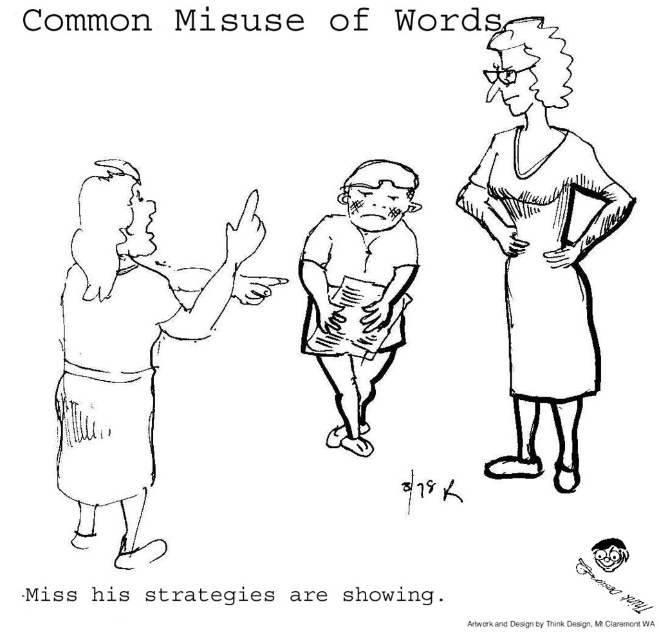
Based on the scene description, which object is bigger between the smooth skin man at left and the fat man at center?

The smooth skin man at left is bigger than the fat man at center according to the description.

In the cartoon scene, where is the matte black dress at right located in terms of coordinates?

The matte black dress at right is located at coordinates point [542,243].

You are a delivery person who needs to deliver a package to the smooth skin man at left. The package can only be delivered if the distance between him and the matte black dress at right is less than 5 feet. Can you deliver the package?

The matte black dress at right is 5.14 feet from the smooth skin man at left. Since the required distance is less than 5 feet, the package cannot be delivered.